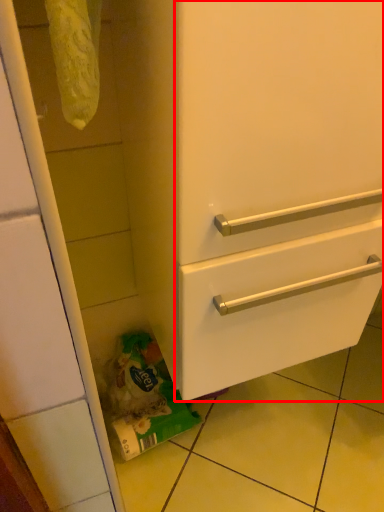
Question: Where is door (annotated by the red box) located in relation to garbage in the image?

Choices:
 (A) left
 (B) right

Answer: (B)